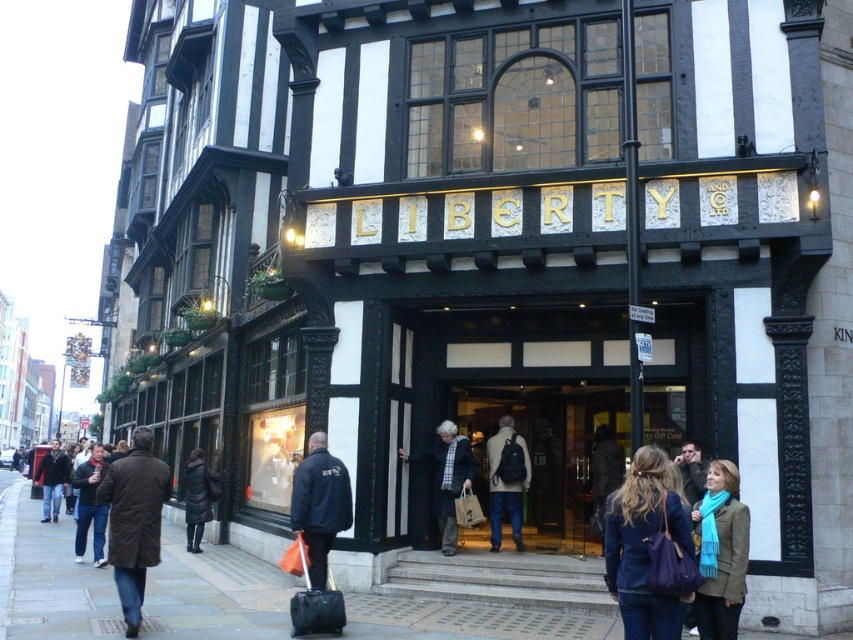
Is blue scarf at lower right wider than black jacket at center?

No.

Can you confirm if blue scarf at lower right is shorter than black jacket at center?

Correct, blue scarf at lower right is not as tall as black jacket at center.

You are a GUI agent. You are given a task and a screenshot of the screen. Output one action in this format:
    pyautogui.click(x=<x>, y=<y>)
    Task: Click on the blue scarf at lower right
    This screenshot has height=640, width=853.
    Given the screenshot: What is the action you would take?
    pyautogui.click(x=720, y=552)

Can you confirm if matte blue jacket at lower right is taller than dark gray wool coat at center?

No.

Is point (627, 584) farther from camera compared to point (444, 490)?

No, (627, 584) is closer to viewer.

Locate an element on the screen. Image resolution: width=853 pixels, height=640 pixels. matte blue jacket at lower right is located at coordinates (643, 545).

Does brown leather coat at lower left have a greater height compared to dark blue jacket at left?

No, brown leather coat at lower left is not taller than dark blue jacket at left.

Between brown leather coat at lower left and dark blue jacket at left, which one appears on the left side from the viewer's perspective?

Positioned to the left is dark blue jacket at left.

Between point (138, 509) and point (59, 486), which one is positioned in front?

Point (138, 509) is in front.

Where is `brown leather coat at lower left`? brown leather coat at lower left is located at coordinates (134, 520).